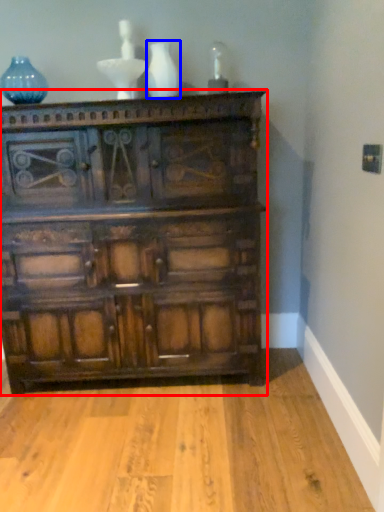
Question: Which object appears closest to the camera in this image, chest of drawers (highlighted by a red box) or vase (highlighted by a blue box)?

Choices:
 (A) chest of drawers
 (B) vase

Answer: (A)